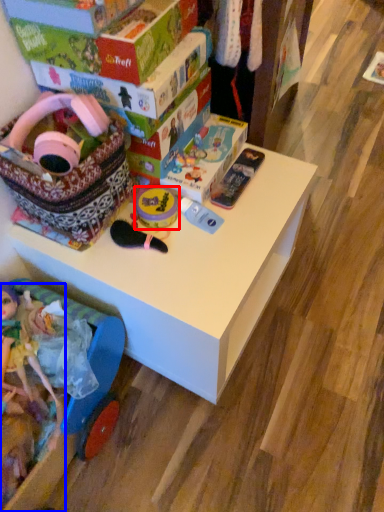
Question: Which point is further to the camera, toy (highlighted by a red box) or toy (highlighted by a blue box)?

Choices:
 (A) toy
 (B) toy

Answer: (A)